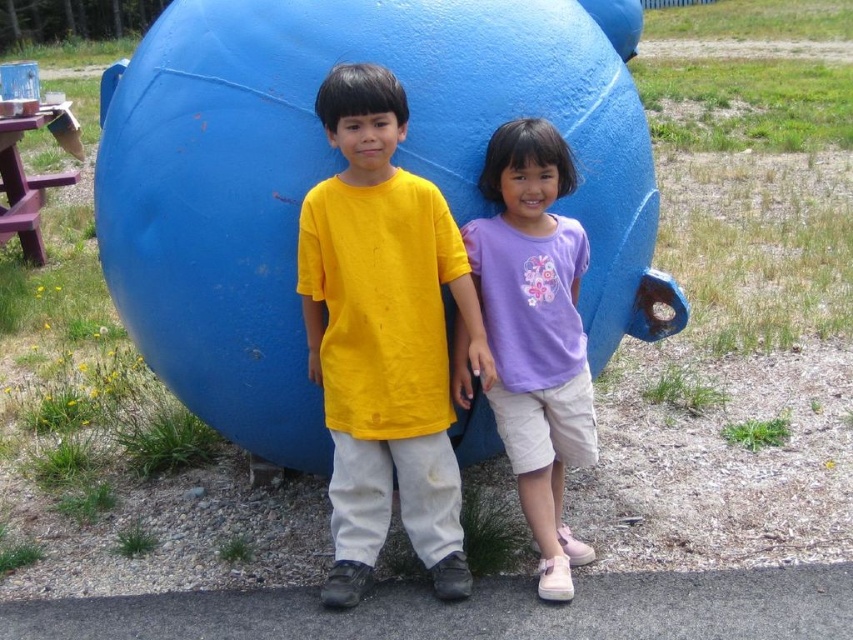
You are planning to set up a game between the purple cotton shirt at center and the purple wood picnic table at left. The game requires the two to be within 5 meters of each other. Based on the scene, will they be able to play the game without moving?

The distance between the purple cotton shirt at center and the purple wood picnic table at left is 5.44 meters, which is more than the required 5 meters. Therefore, they cannot play the game without moving closer.